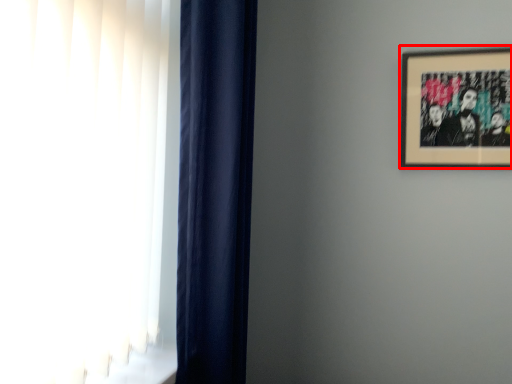
Question: From the image's perspective, where is picture frame (annotated by the red box) located in relation to curtain in the image?

Choices:
 (A) above
 (B) below

Answer: (A)